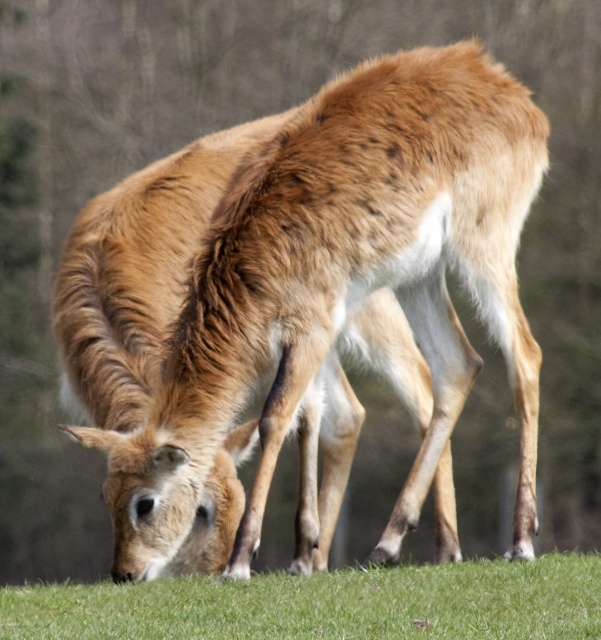
You are a photographer aiming to capture a clear photo of the brown fur deer at center and the green grass at lower center in the image. Considering the focus distance, can you focus on both subjects simultaneously if your camera has a depth of field that can cover 30 inches?

The brown fur deer at center and green grass at lower center are 31.13 inches apart. Since the depth of field can only cover 30 inches, the camera cannot focus on both subjects simultaneously.

You are standing in the field and want to approach the brown fur deer at center. Based on its position, which direction should you move to get closer?

To approach the brown fur deer at center, you should move towards the coordinates specified at point [343,285].